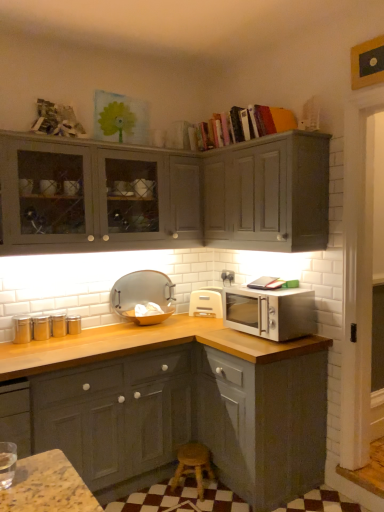
Identify the location of free spot above matte gray cabinets at lower left, acting as the third cabinetry starting from the top (from a real-world perspective). The image size is (384, 512). (87, 339).